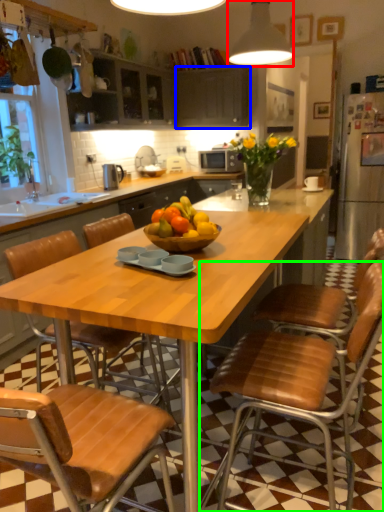
Question: Based on their relative distances, which object is farther from light fixture (highlighted by a red box)? Choose from cabinetry (highlighted by a blue box) and chair (highlighted by a green box).

Choices:
 (A) cabinetry
 (B) chair

Answer: (A)